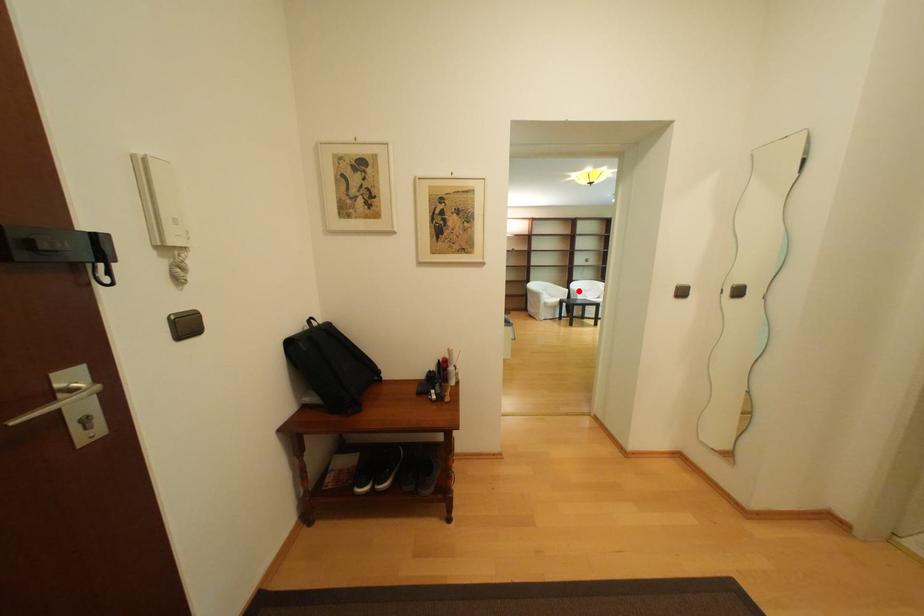
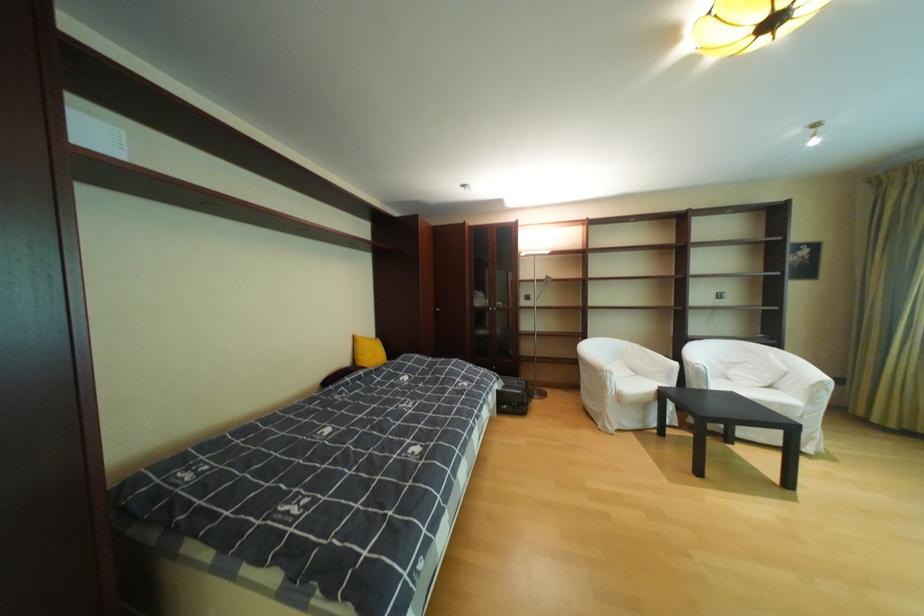
Find the pixel in the second image that matches the highlighted location in the first image.

(687, 365)